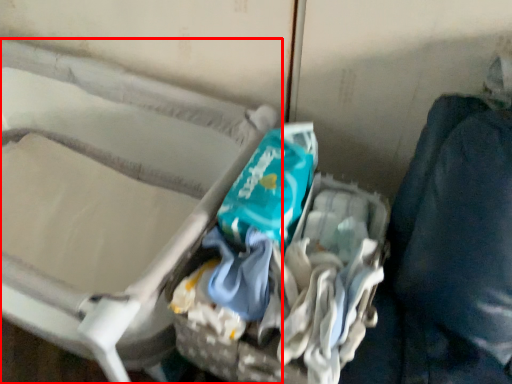
Question: In this image, where is furniture (annotated by the red box) located relative to garbage?

Choices:
 (A) right
 (B) left

Answer: (B)